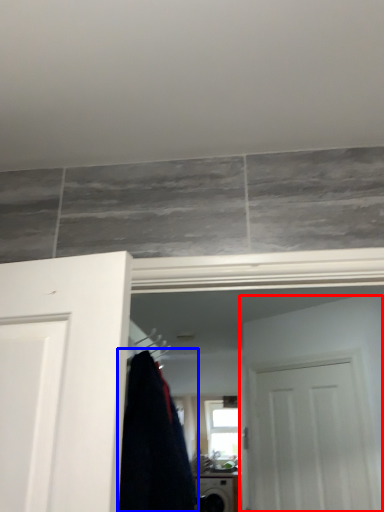
Question: Which object appears closest to the camera in this image, door (highlighted by a red box) or clothing (highlighted by a blue box)?

Choices:
 (A) door
 (B) clothing

Answer: (B)